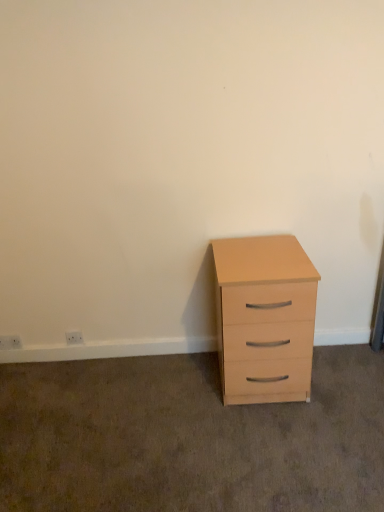
At what (x,y) coordinates should I click in order to perform the action: click on unoccupied region to the right of light wood chest of drawers at right. Please return your answer as a coordinate pair (x, y). Looking at the image, I should click on (343, 380).